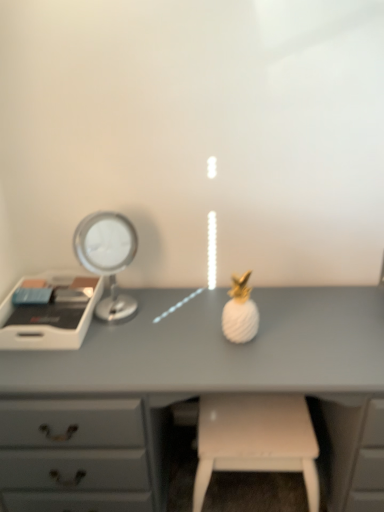
Find the location of `free space to the back side of silver metallic mirror at left`. free space to the back side of silver metallic mirror at left is located at coordinates (122, 294).